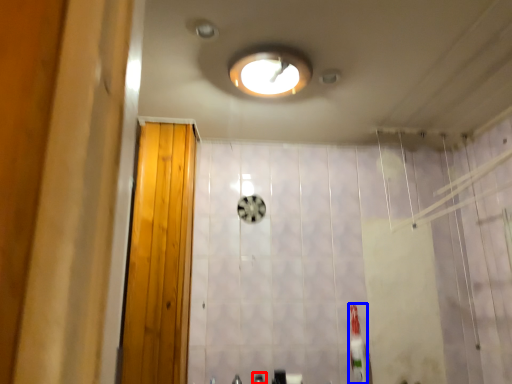
Question: Among these objects, which one is nearest to the camera, faucet (highlighted by a red box) or toothbrush (highlighted by a blue box)?

Choices:
 (A) faucet
 (B) toothbrush

Answer: (A)